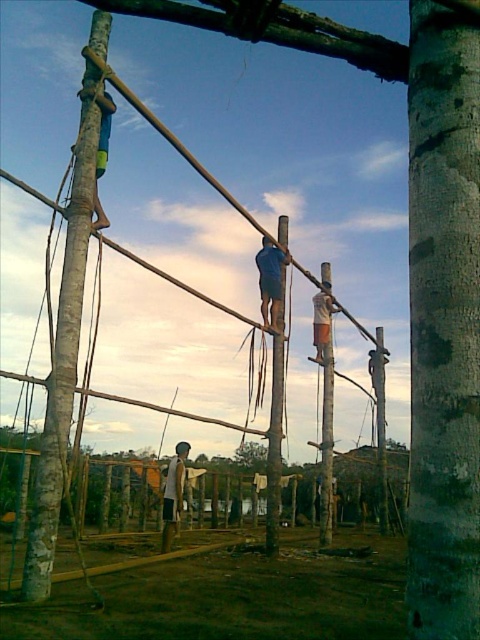
Does white fabric shirt at center appear on the left side of light brown wooden pole at center?

Correct, you'll find white fabric shirt at center to the left of light brown wooden pole at center.

Is white fabric shirt at center smaller than light brown wooden pole at center?

Yes, white fabric shirt at center is smaller than light brown wooden pole at center.

Is point (178, 480) farther from camera compared to point (321, 337)?

No, (178, 480) is closer to viewer.

Identify the location of white fabric shirt at center. (173, 493).

The height and width of the screenshot is (640, 480). What do you see at coordinates (271, 278) in the screenshot? I see `blue fabric construction worker at center` at bounding box center [271, 278].

Between blue fabric construction worker at center and light brown wooden pole at center, which one appears on the right side from the viewer's perspective?

From the viewer's perspective, light brown wooden pole at center appears more on the right side.

Between point (264, 305) and point (320, 294), which one is positioned behind?

The point (320, 294) is more distant.

Identify the location of blue fabric construction worker at center. This screenshot has height=640, width=480. (271, 278).

Locate an element on the screen. The width and height of the screenshot is (480, 640). smooth bamboo pole at center is located at coordinates (275, 433).

Where is `smooth bamboo pole at center`? smooth bamboo pole at center is located at coordinates (275, 433).